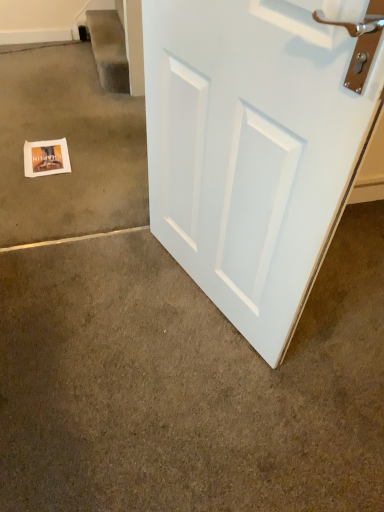
Describe the element at coordinates (46, 158) in the screenshot. I see `matte paper postcard at lower left` at that location.

You are a GUI agent. You are given a task and a screenshot of the screen. Output one action in this format:
    pyautogui.click(x=<x>, y=<y>)
    Task: Click on the white paper at lower left, placed as the second concrete when sorted from bottom to top
    The width and height of the screenshot is (384, 512).
    Given the screenshot: What is the action you would take?
    pyautogui.click(x=69, y=148)

This screenshot has height=512, width=384. Describe the element at coordinates (109, 49) in the screenshot. I see `carpeted stairwell at upper left` at that location.

The height and width of the screenshot is (512, 384). What are the coordinates of `white matte door at center, which is counted as the 2th concrete, starting from the back` in the screenshot? It's located at (187, 384).

The width and height of the screenshot is (384, 512). What do you see at coordinates (252, 151) in the screenshot?
I see `white matte door at right` at bounding box center [252, 151].

Identify the location of matte paper postcard at lower left. The height and width of the screenshot is (512, 384). (46, 158).

From a real-world perspective, between white paper at lower left, which is counted as the first concrete, starting from the back, and white matte door at center, arranged as the second concrete when viewed from the top, who is vertically lower?

From a 3D spatial view, white matte door at center, arranged as the second concrete when viewed from the top, is below.

Does point (82, 148) come farther from viewer compared to point (287, 473)?

Yes, it is behind point (287, 473).

Considering their positions, is white paper at lower left, placed as the second concrete when sorted from bottom to top, located in front of or behind white matte door at center, arranged as the second concrete when viewed from the top?

white paper at lower left, placed as the second concrete when sorted from bottom to top, is behind white matte door at center, arranged as the second concrete when viewed from the top.

Are white paper at lower left, the 1th concrete when ordered from top to bottom, and white matte door at center, which is counted as the 2th concrete, starting from the back, located far from each other?

No, there isn't a large distance between white paper at lower left, the 1th concrete when ordered from top to bottom, and white matte door at center, which is counted as the 2th concrete, starting from the back.

Considering the sizes of objects carpeted stairwell at upper left and white paper at lower left, placed as the second concrete when sorted from bottom to top, in the image provided, who is thinner, carpeted stairwell at upper left or white paper at lower left, placed as the second concrete when sorted from bottom to top,?

With smaller width is carpeted stairwell at upper left.

Between carpeted stairwell at upper left and white paper at lower left, which appears as the 2th concrete when viewed from the front, which one appears on the right side from the viewer's perspective?

Positioned to the right is carpeted stairwell at upper left.

I want to click on the 1st concrete located beneath the carpeted stairwell at upper left (from a real-world perspective), so click(x=69, y=148).

From the image's perspective, which one is positioned lower, white matte door at right or white matte door at center, which ranks as the first concrete in bottom-to-top order?

white matte door at center, which ranks as the first concrete in bottom-to-top order, from the image's perspective.

Would you say white matte door at right is inside or outside white matte door at center, which ranks as the first concrete in bottom-to-top order?

white matte door at right is outside white matte door at center, which ranks as the first concrete in bottom-to-top order.

You are a GUI agent. You are given a task and a screenshot of the screen. Output one action in this format:
    pyautogui.click(x=<x>, y=<y>)
    Task: Click on the door that appears above the white matte door at center, arranged as the second concrete when viewed from the top (from the image's perspective)
    The width and height of the screenshot is (384, 512).
    Given the screenshot: What is the action you would take?
    pyautogui.click(x=252, y=151)

Based on their positions, is white matte door at right located to the left or right of matte paper postcard at lower left?

Clearly, white matte door at right is on the right of matte paper postcard at lower left in the image.

In terms of width, does white matte door at right look wider or thinner when compared to matte paper postcard at lower left?

Considering their sizes, white matte door at right looks slimmer than matte paper postcard at lower left.

Are white matte door at right and matte paper postcard at lower left located far from each other?

That's right, there is a large distance between white matte door at right and matte paper postcard at lower left.

From a real-world perspective, is white matte door at right physically below matte paper postcard at lower left?

Actually, white matte door at right is physically above matte paper postcard at lower left in the real world.

Is white matte door at right in front of carpeted stairwell at upper left?

Yes, it is.

Is white matte door at right oriented towards carpeted stairwell at upper left?

No, white matte door at right is not turned towards carpeted stairwell at upper left.

Between white matte door at right and carpeted stairwell at upper left, which one appears on the right side from the viewer's perspective?

Positioned to the right is white matte door at right.

Can you confirm if carpeted stairwell at upper left is bigger than matte paper postcard at lower left?

Yes.

Could you tell me if carpeted stairwell at upper left is facing matte paper postcard at lower left?

No, carpeted stairwell at upper left is not oriented towards matte paper postcard at lower left.

Which is less distant, (x=108, y=17) or (x=58, y=159)?

The point (x=58, y=159) is closer.

Which object is positioned more to the left, carpeted stairwell at upper left or matte paper postcard at lower left?

matte paper postcard at lower left is more to the left.

Which is behind, point (96, 418) or point (95, 38)?

Positioned behind is point (95, 38).

How many degrees apart are the facing directions of white matte door at center, arranged as the second concrete when viewed from the top, and carpeted stairwell at upper left?

The facing directions of white matte door at center, arranged as the second concrete when viewed from the top, and carpeted stairwell at upper left are 88.8 degrees apart.

Does white matte door at center, placed as the 1th concrete when sorted from front to back, lie behind carpeted stairwell at upper left?

No, white matte door at center, placed as the 1th concrete when sorted from front to back, is closer to the viewer.

Can you confirm if white matte door at center, placed as the 1th concrete when sorted from front to back, is positioned to the left of carpeted stairwell at upper left?

No, white matte door at center, placed as the 1th concrete when sorted from front to back, is not to the left of carpeted stairwell at upper left.

Find the location of a particular element. The image size is (384, 512). concrete above the white matte door at center, placed as the 1th concrete when sorted from front to back (from the image's perspective) is located at coordinates (69, 148).

You are a GUI agent. You are given a task and a screenshot of the screen. Output one action in this format:
    pyautogui.click(x=<x>, y=<y>)
    Task: Click on the concrete that is the 1st object directly below the carpeted stairwell at upper left (from a real-world perspective)
    This screenshot has height=512, width=384.
    Given the screenshot: What is the action you would take?
    pyautogui.click(x=69, y=148)

Which object lies nearer to the anchor point white matte door at center, which is counted as the 2th concrete, starting from the back, matte paper postcard at lower left or white matte door at right?

white matte door at right is positioned closer to the anchor white matte door at center, which is counted as the 2th concrete, starting from the back.

Based on their spatial positions, is white matte door at center, which ranks as the first concrete in bottom-to-top order, or matte paper postcard at lower left further from white matte door at right?

matte paper postcard at lower left is positioned further to the anchor white matte door at right.

Estimate the real-world distances between objects in this image. Which object is closer to carpeted stairwell at upper left, matte paper postcard at lower left or white matte door at right?

matte paper postcard at lower left.

Looking at this image, from the image, which object appears to be nearer to white matte door at center, which ranks as the first concrete in bottom-to-top order, white matte door at right or matte paper postcard at lower left?

white matte door at right lies closer to white matte door at center, which ranks as the first concrete in bottom-to-top order, than the other object.

Which object lies nearer to the anchor point white matte door at center, placed as the 1th concrete when sorted from front to back, matte paper postcard at lower left or white paper at lower left, the 1th concrete when ordered from top to bottom?

Based on the image, white paper at lower left, the 1th concrete when ordered from top to bottom, appears to be nearer to white matte door at center, placed as the 1th concrete when sorted from front to back.

Based on their spatial positions, is matte paper postcard at lower left or white matte door at center, placed as the 1th concrete when sorted from front to back, further from carpeted stairwell at upper left?

white matte door at center, placed as the 1th concrete when sorted from front to back, lies further to carpeted stairwell at upper left than the other object.

Considering their positions, is white matte door at center, arranged as the second concrete when viewed from the top, positioned further to white paper at lower left, the 1th concrete when ordered from top to bottom, than white matte door at right?

white matte door at center, arranged as the second concrete when viewed from the top, lies further to white paper at lower left, the 1th concrete when ordered from top to bottom, than the other object.

From the image, which object appears to be nearer to matte paper postcard at lower left, white paper at lower left, which is counted as the first concrete, starting from the back, or white matte door at center, placed as the 1th concrete when sorted from front to back?

white paper at lower left, which is counted as the first concrete, starting from the back.

You are a GUI agent. You are given a task and a screenshot of the screen. Output one action in this format:
    pyautogui.click(x=<x>, y=<y>)
    Task: Click on the concrete that lies between carpeted stairwell at upper left and matte paper postcard at lower left from top to bottom
    The height and width of the screenshot is (512, 384).
    Given the screenshot: What is the action you would take?
    pyautogui.click(x=69, y=148)

Where is `postcard that lies between carpeted stairwell at upper left and white matte door at center, placed as the 1th concrete when sorted from front to back, from top to bottom`? postcard that lies between carpeted stairwell at upper left and white matte door at center, placed as the 1th concrete when sorted from front to back, from top to bottom is located at coordinates (46, 158).

Where is `concrete between carpeted stairwell at upper left and white matte door at center, arranged as the second concrete when viewed from the top, from top to bottom`? The image size is (384, 512). concrete between carpeted stairwell at upper left and white matte door at center, arranged as the second concrete when viewed from the top, from top to bottom is located at coordinates (69, 148).

The image size is (384, 512). I want to click on postcard between white matte door at right and carpeted stairwell at upper left from front to back, so click(46, 158).